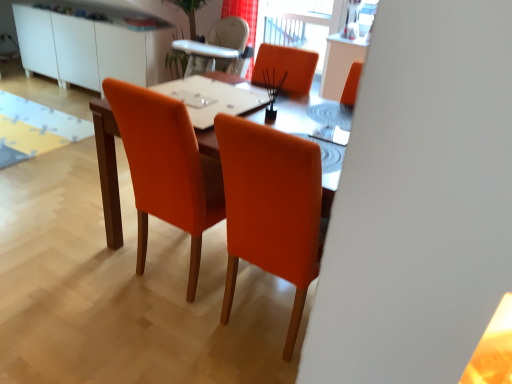
Question: Is white glossy table at center taller or shorter than transparent glass window screen at upper center?

Choices:
 (A) tall
 (B) short

Answer: (B)

Question: Considering the positions of white glossy table at center and transparent glass window screen at upper center in the image, is white glossy table at center wider or thinner than transparent glass window screen at upper center?

Choices:
 (A) wide
 (B) thin

Answer: (A)

Question: Which is farther from the transparent glass window screen at upper center?

Choices:
 (A) white glossy cabinet at upper left
 (B) red fabric curtain at upper center
 (C) white glossy table at center
 (D) orange fabric chair at center

Answer: (D)

Question: Estimate the real-world distances between objects in this image. Which object is farther from the red fabric curtain at upper center?

Choices:
 (A) orange fabric chair at center
 (B) white glossy cabinet at upper left
 (C) white glossy table at center
 (D) transparent glass window screen at upper center

Answer: (A)